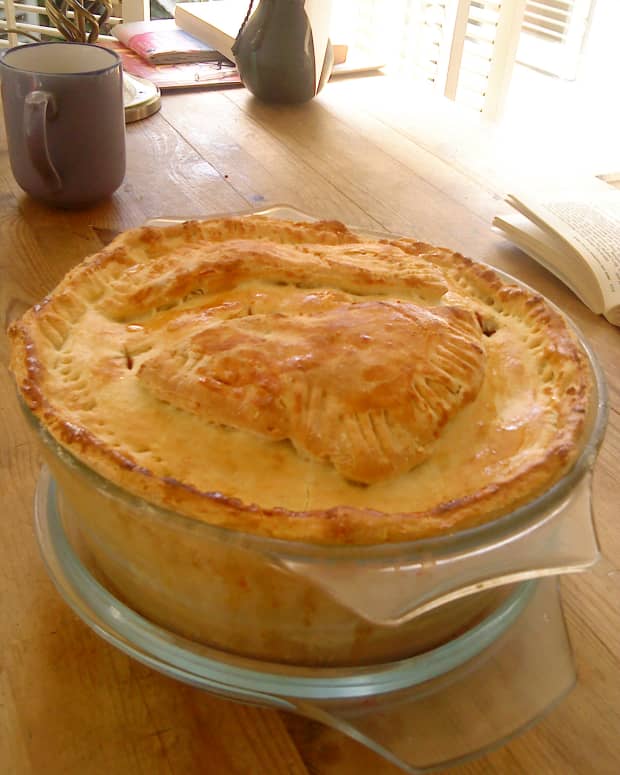
In order to click on handle to pick cup up in this screenshot , I will do `click(41, 115)`.